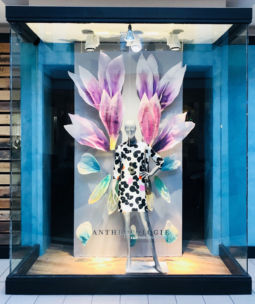
Locate an element on the screen. This screenshot has height=304, width=255. wood floor is located at coordinates (89, 263).